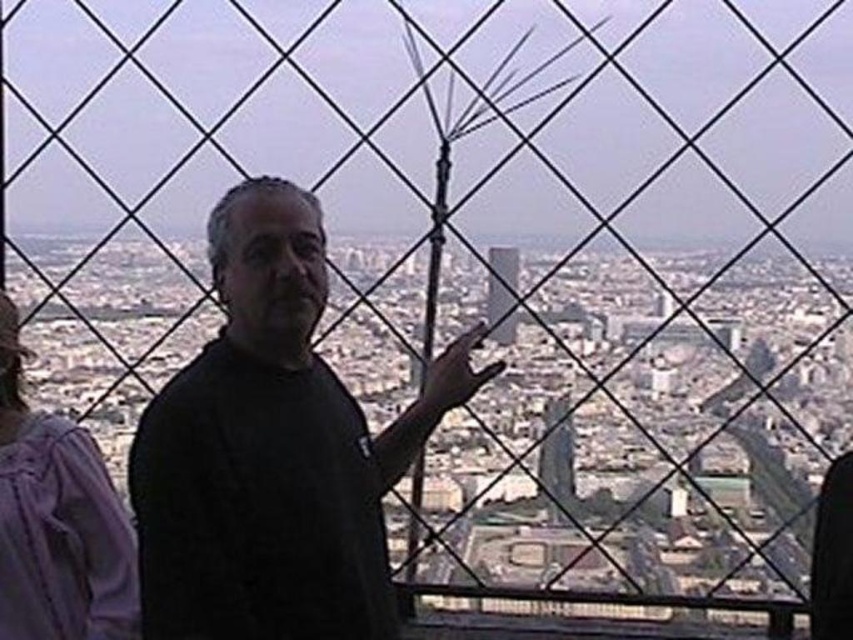
You are a photographer aiming to capture a cityscape with the purple cotton hoodie at left in the frame. Given that the hoodie is at coordinates point 0.814, 0.068, can you estimate its location relative to the center of the image?

The purple cotton hoodie at left is located at point (57,520), which is to the upper left of the image center.

You are a photographer trying to capture the purple cotton hoodie at left and the smooth glass skyscraper at center in the same frame. Considering their heights, which object will appear larger in the photo?

The purple cotton hoodie at left is much taller than the smooth glass skyscraper at center, so it will appear larger in the photo.